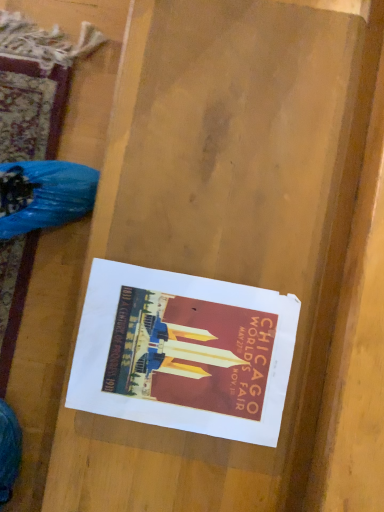
Question: Should I look upward or downward to see white paper poster at center?

Choices:
 (A) down
 (B) up

Answer: (A)